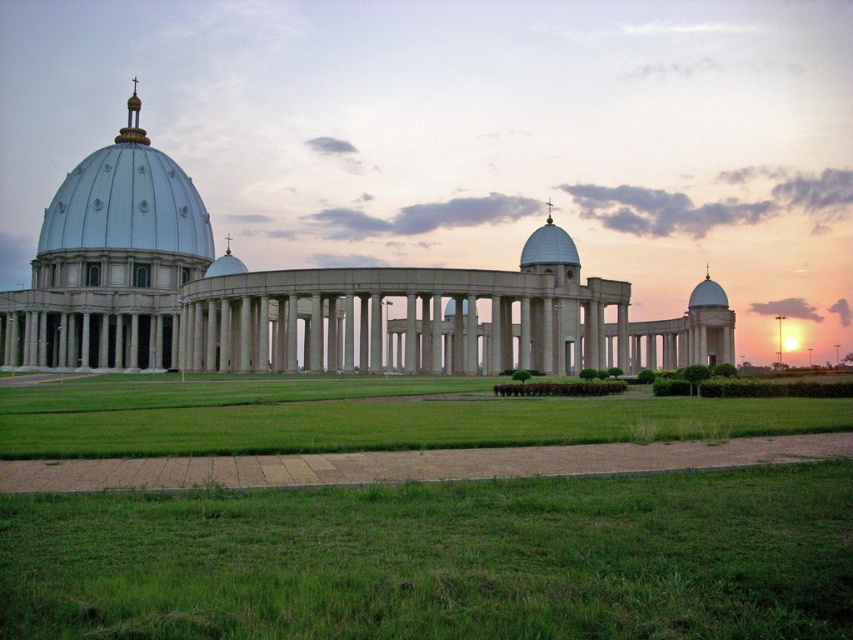
Question: Which point is closer to the camera?

Choices:
 (A) (573, 259)
 (B) (99, 388)
 (C) (38, 563)

Answer: (C)

Question: Can you confirm if green grass at lower center is positioned to the right of green grass at center?

Choices:
 (A) yes
 (B) no

Answer: (A)

Question: Does white marble building at center appear on the left side of metallic silver dome at upper left?

Choices:
 (A) yes
 (B) no

Answer: (B)

Question: Which object appears closest to the camera in this image?

Choices:
 (A) white marble building at center
 (B) metallic silver dome at upper left
 (C) white glossy dome at center
 (D) green grass at center

Answer: (D)

Question: Considering the relative positions of white marble building at center and white glossy dome at center in the image provided, where is white marble building at center located with respect to white glossy dome at center?

Choices:
 (A) below
 (B) above

Answer: (B)

Question: Which of the following is the farthest from the observer?

Choices:
 (A) white glossy dome at center
 (B) metallic silver dome at upper left
 (C) green grass at center

Answer: (B)